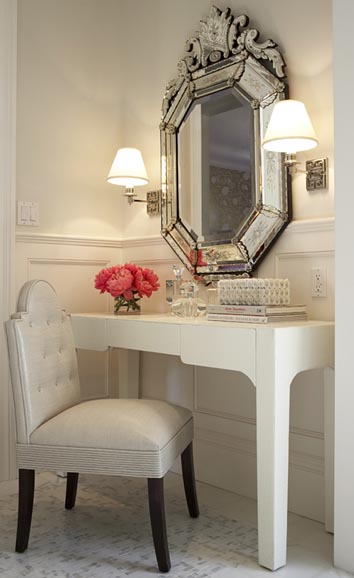
Where is `floor`? The height and width of the screenshot is (578, 354). floor is located at coordinates (96, 551).